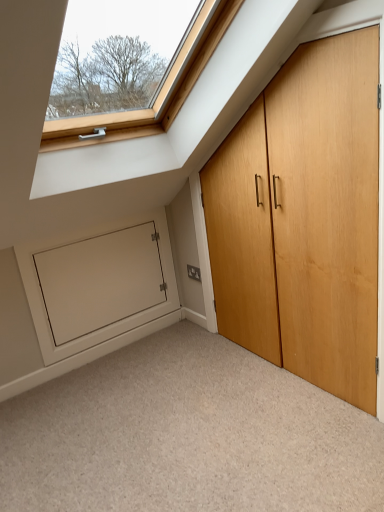
Question: From a real-world perspective, does light brown wood door at right stand above carpeted floor at lower center?

Choices:
 (A) yes
 (B) no

Answer: (A)

Question: Does light brown wood door at right have a smaller size compared to carpeted floor at lower center?

Choices:
 (A) no
 (B) yes

Answer: (A)

Question: Does light brown wood door at right have a greater height compared to carpeted floor at lower center?

Choices:
 (A) yes
 (B) no

Answer: (A)

Question: Is light brown wood door at right to the left of carpeted floor at lower center from the viewer's perspective?

Choices:
 (A) no
 (B) yes

Answer: (A)

Question: From the image's perspective, is light brown wood door at right under carpeted floor at lower center?

Choices:
 (A) yes
 (B) no

Answer: (B)

Question: Is light brown wood door at right closer to the viewer compared to carpeted floor at lower center?

Choices:
 (A) yes
 (B) no

Answer: (B)

Question: Considering the relative positions of light brown wood door at right and white matte door at lower left in the image provided, is light brown wood door at right in front of white matte door at lower left?

Choices:
 (A) no
 (B) yes

Answer: (B)

Question: From a real-world perspective, is light brown wood door at right below white matte door at lower left?

Choices:
 (A) no
 (B) yes

Answer: (A)

Question: Is light brown wood door at right oriented away from white matte door at lower left?

Choices:
 (A) no
 (B) yes

Answer: (A)

Question: Can you confirm if light brown wood door at right is thinner than white matte door at lower left?

Choices:
 (A) no
 (B) yes

Answer: (A)

Question: Can white matte door at lower left be found inside light brown wood door at right?

Choices:
 (A) yes
 (B) no

Answer: (B)

Question: Is light brown wood door at right bigger than white matte door at lower left?

Choices:
 (A) no
 (B) yes

Answer: (B)

Question: Is white matte door at lower left thinner than carpeted floor at lower center?

Choices:
 (A) no
 (B) yes

Answer: (B)